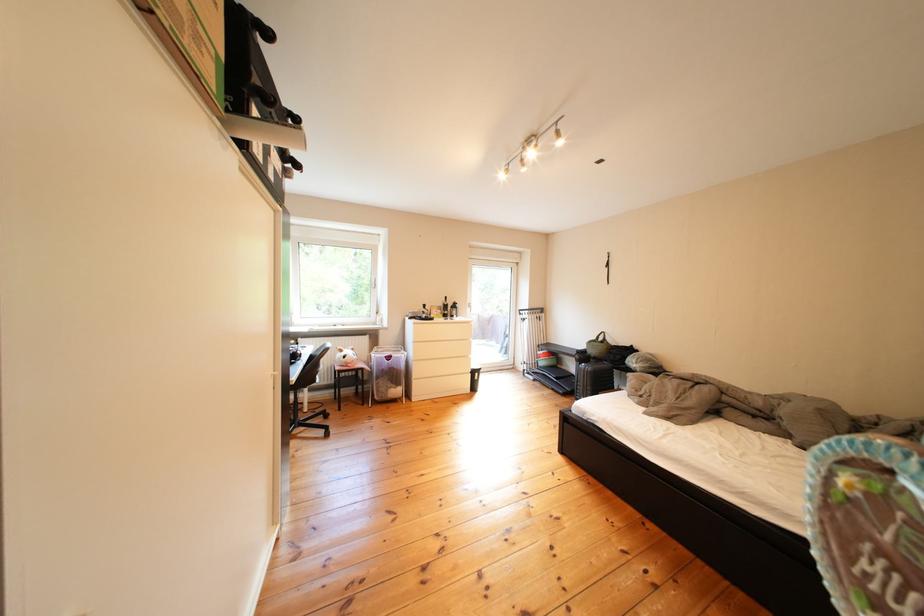
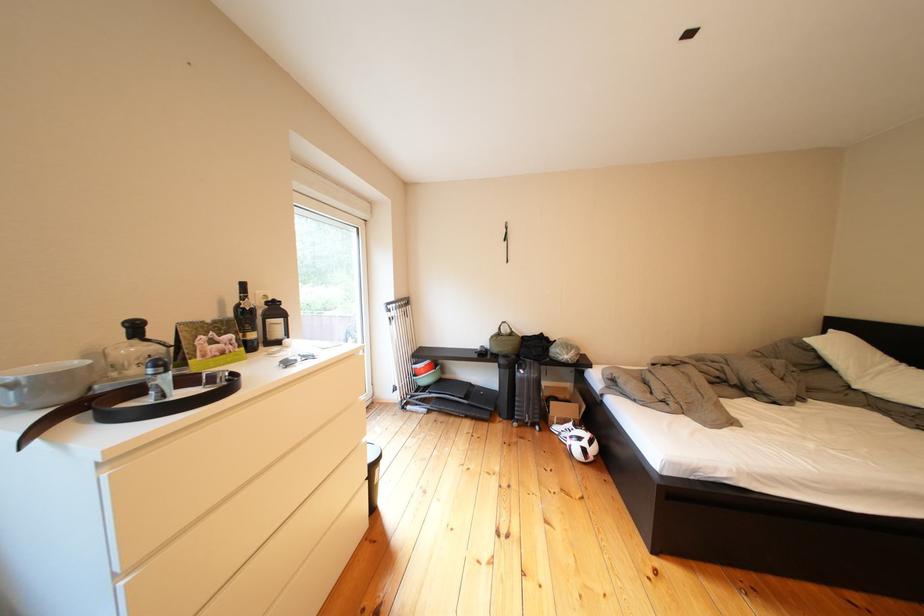
Where in the second image is the point corresponding to (x=591, y=361) from the first image?

(516, 366)